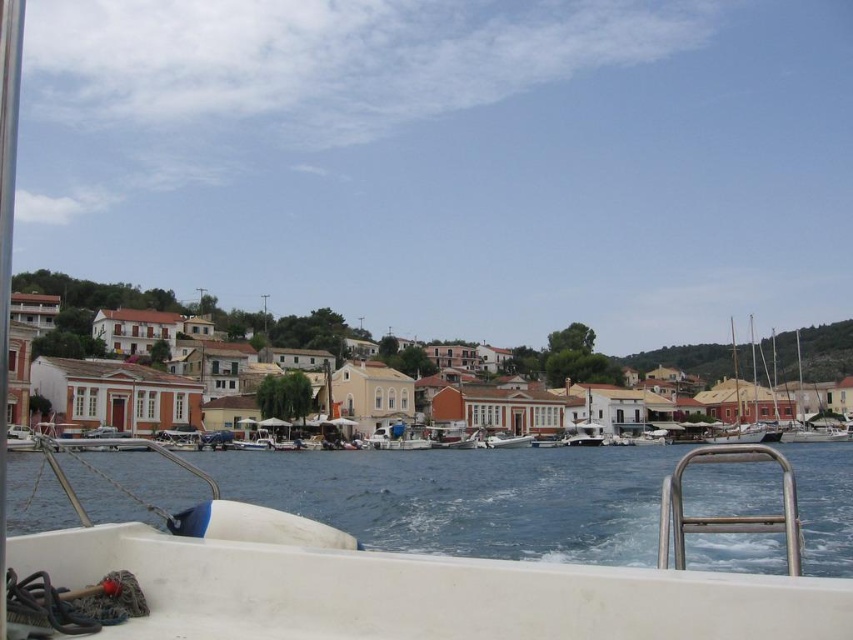
Question: Which object is closer to the camera taking this photo?

Choices:
 (A) white glossy boat at center
 (B) white matte boat at center
 (C) blue water at lower center

Answer: (C)

Question: Does blue water at lower center appear on the left side of white matte boat at center?

Choices:
 (A) no
 (B) yes

Answer: (A)

Question: Among these objects, which one is nearest to the camera?

Choices:
 (A) white matte boat at center
 (B) white glossy boat at center
 (C) white matte building at center
 (D) blue water at lower center

Answer: (D)

Question: Does blue water at lower center have a lesser width compared to white matte building at center?

Choices:
 (A) no
 (B) yes

Answer: (B)

Question: Estimate the real-world distances between objects in this image. Which object is closer to the blue water at lower center?

Choices:
 (A) white matte boat at center
 (B) white glossy boat at center

Answer: (A)

Question: Does white matte building at center have a larger size compared to white glossy boat at center?

Choices:
 (A) no
 (B) yes

Answer: (B)